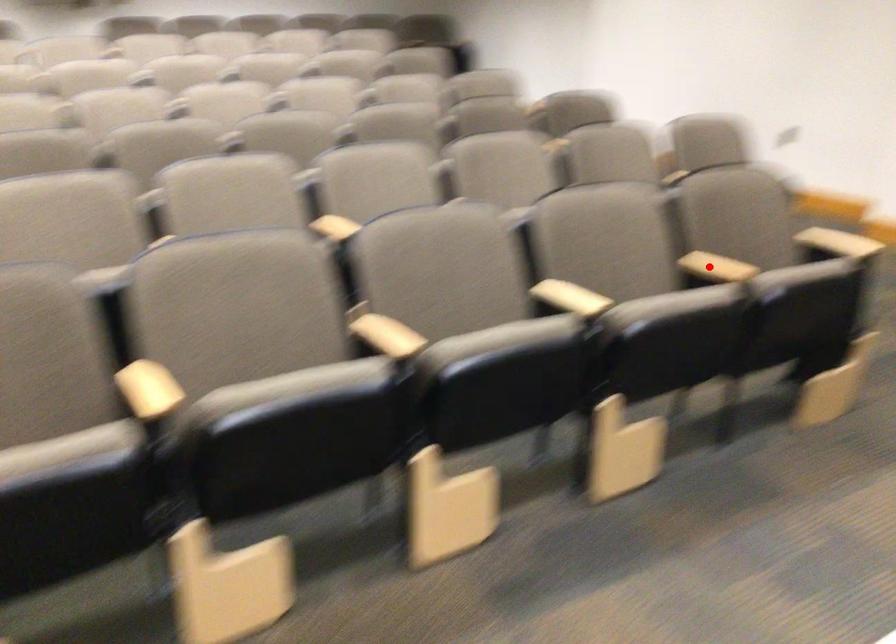
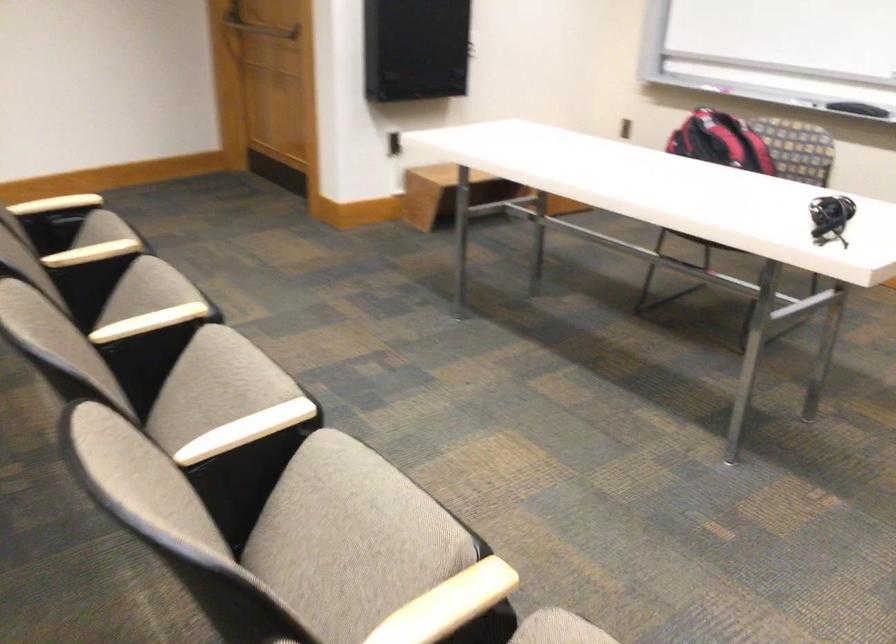
The point at the highlighted location is marked in the first image. Where is the corresponding point in the second image?

(92, 252)